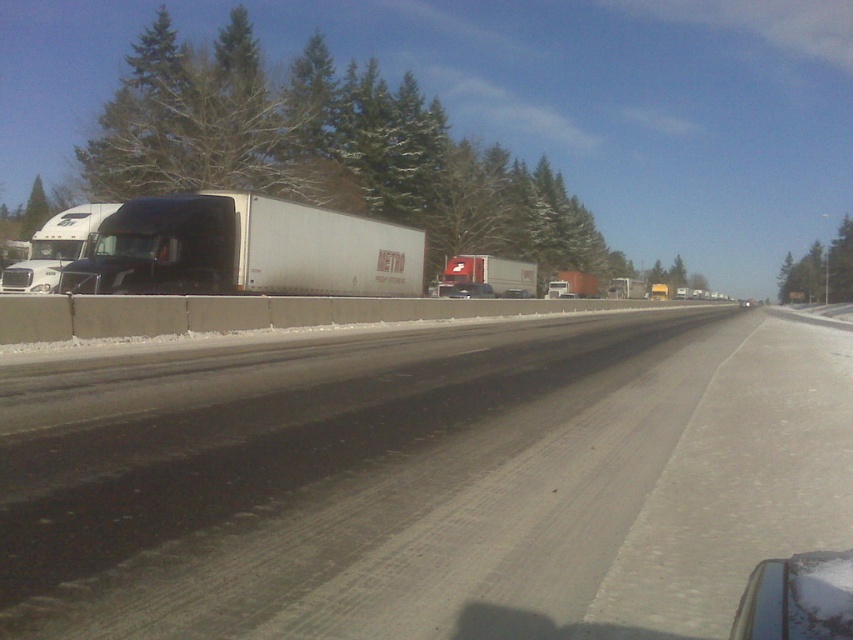
Question: Can you confirm if gray asphalt highway at center is thinner than white glossy truck at left?

Choices:
 (A) yes
 (B) no

Answer: (B)

Question: Can you confirm if white glossy truck at left is smaller than white matte truck at center?

Choices:
 (A) yes
 (B) no

Answer: (B)

Question: Which point is farther from the camera taking this photo?

Choices:
 (A) (142, 205)
 (B) (469, 259)

Answer: (B)

Question: Which of these objects is positioned closest to the gray asphalt highway at center?

Choices:
 (A) white glossy truck at left
 (B) white matte truck at center
 (C) white matte trailer truck at left

Answer: (C)

Question: Which of the following is the farthest from the observer?

Choices:
 (A) white matte truck at center
 (B) white matte trailer truck at left

Answer: (A)

Question: Is gray asphalt highway at center further to the viewer compared to white matte truck at center?

Choices:
 (A) yes
 (B) no

Answer: (B)